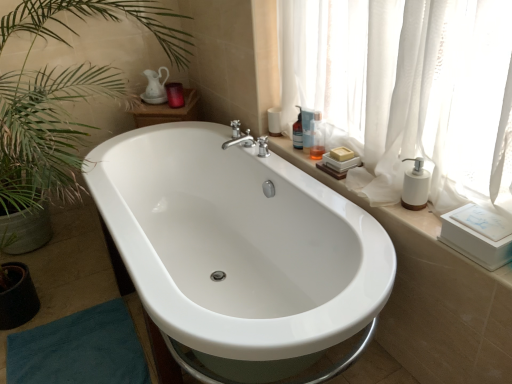
Find the location of a particular element. The height and width of the screenshot is (384, 512). vacant space situated on the left part of white matte soap dispenser at right is located at coordinates (382, 206).